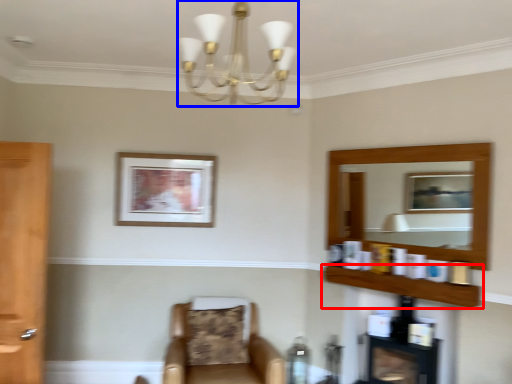
Question: Which object appears closest to the camera in this image, shelf (highlighted by a red box) or light fixture (highlighted by a blue box)?

Choices:
 (A) shelf
 (B) light fixture

Answer: (B)